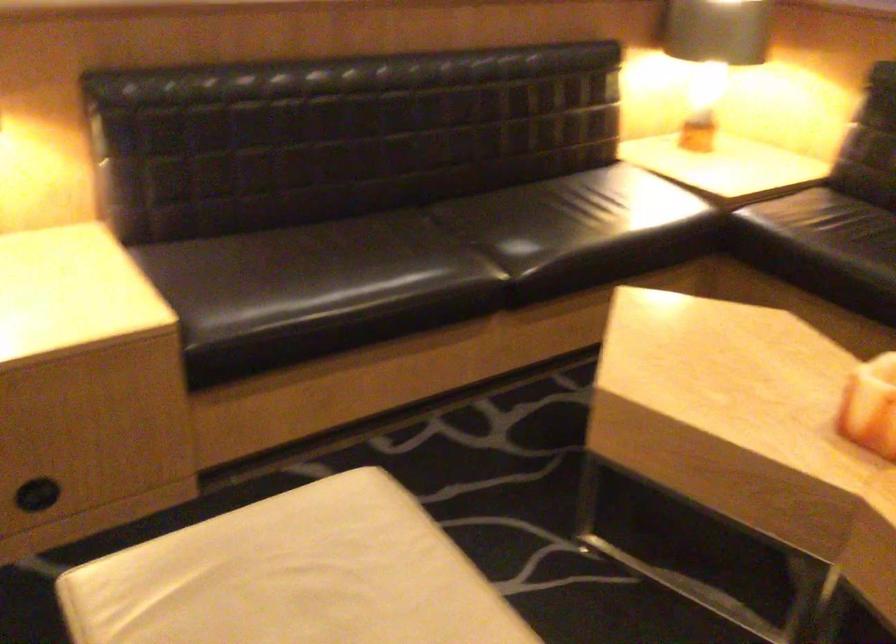
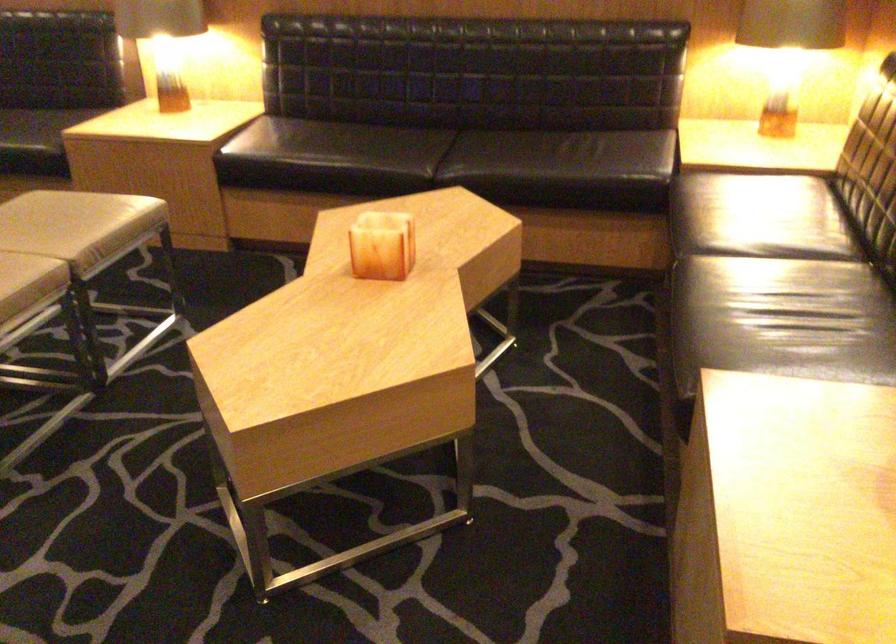
Where in the second image is the point corresponding to pixel 398 444 from the first image?

(283, 263)